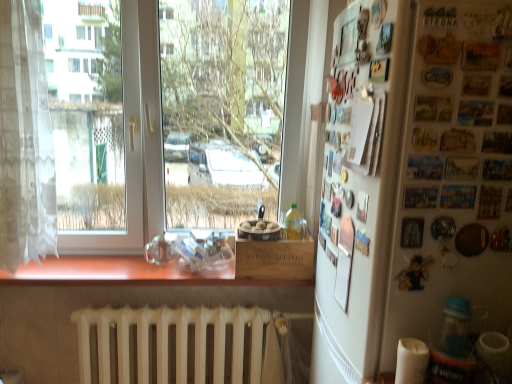
Question: Does white matte radiator at lower center turn towards metallic silver magnets at right?

Choices:
 (A) no
 (B) yes

Answer: (A)

Question: Are white matte radiator at lower center and metallic silver magnets at right making contact?

Choices:
 (A) no
 (B) yes

Answer: (A)

Question: From a real-world perspective, is white matte radiator at lower center beneath metallic silver magnets at right?

Choices:
 (A) no
 (B) yes

Answer: (B)

Question: Does white matte radiator at lower center appear on the left side of metallic silver magnets at right?

Choices:
 (A) no
 (B) yes

Answer: (B)

Question: From a real-world perspective, is white matte radiator at lower center on metallic silver magnets at right?

Choices:
 (A) yes
 (B) no

Answer: (B)

Question: In terms of height, does white matte radiator at lower center look taller or shorter compared to white lace curtain at left?

Choices:
 (A) short
 (B) tall

Answer: (A)

Question: From the image's perspective, is white matte radiator at lower center located above or below white lace curtain at left?

Choices:
 (A) above
 (B) below

Answer: (B)

Question: Is white matte radiator at lower center bigger or smaller than white lace curtain at left?

Choices:
 (A) big
 (B) small

Answer: (A)

Question: Choose the correct answer: Is white matte radiator at lower center inside white lace curtain at left or outside it?

Choices:
 (A) outside
 (B) inside

Answer: (A)

Question: Considering the positions of metallic silver magnets at right and yellow translucent bottle at center, the first bottle from the top, in the image, is metallic silver magnets at right taller or shorter than yellow translucent bottle at center, the first bottle from the top,?

Choices:
 (A) tall
 (B) short

Answer: (A)

Question: Relative to yellow translucent bottle at center, arranged as the first bottle when viewed from the left, is metallic silver magnets at right in front or behind?

Choices:
 (A) behind
 (B) front

Answer: (B)

Question: From the image's perspective, is metallic silver magnets at right positioned above or below yellow translucent bottle at center, the second bottle in the bottom-to-top sequence?

Choices:
 (A) above
 (B) below

Answer: (A)

Question: Considering the positions of metallic silver magnets at right and yellow translucent bottle at center, arranged as the first bottle when viewed from the left, in the image, is metallic silver magnets at right wider or thinner than yellow translucent bottle at center, arranged as the first bottle when viewed from the left,?

Choices:
 (A) thin
 (B) wide

Answer: (A)

Question: In the image, is translucent plastic bottle at lower right, marked as the 2th bottle in a top-to-bottom arrangement, positioned in front of or behind yellow translucent bottle at center, the second bottle in the bottom-to-top sequence?

Choices:
 (A) front
 (B) behind

Answer: (A)

Question: Is translucent plastic bottle at lower right, the 2th bottle when ordered from back to front, bigger or smaller than yellow translucent bottle at center, marked as the first bottle in a back-to-front arrangement?

Choices:
 (A) small
 (B) big

Answer: (A)